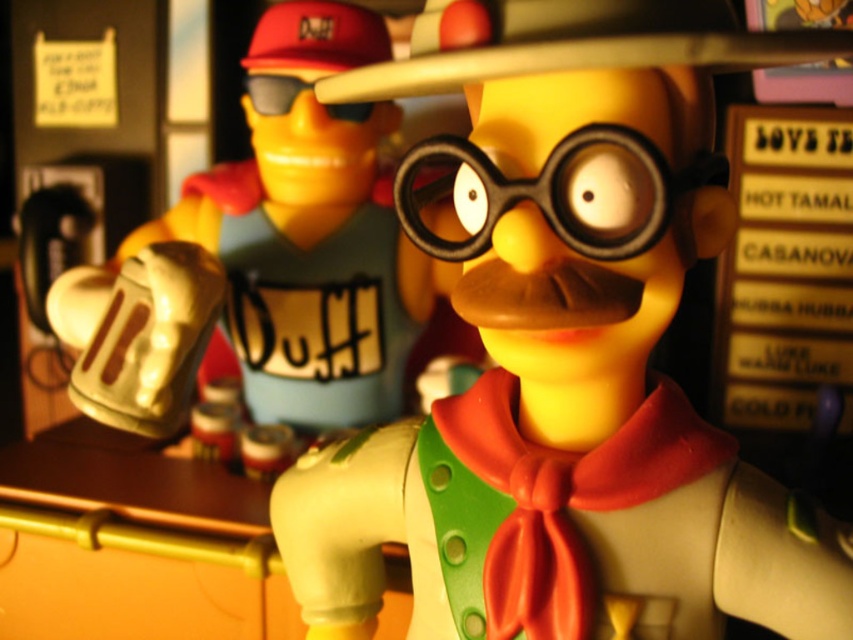
Between point (670, 65) and point (91, 368), which one is positioned behind?

Positioned behind is point (91, 368).

From the picture: Is matte plastic beer mug at upper left below metallic gold mug at upper left?

Correct, matte plastic beer mug at upper left is located below metallic gold mug at upper left.

Where is `matte plastic beer mug at upper left`? Image resolution: width=853 pixels, height=640 pixels. matte plastic beer mug at upper left is located at coordinates (563, 360).

How much distance is there between metallic gold mug at upper left and black matte goggles at upper center?

They are 6.11 inches apart.

Is metallic gold mug at upper left to the right of black matte goggles at upper center from the viewer's perspective?

In fact, metallic gold mug at upper left is to the left of black matte goggles at upper center.

Between point (189, 234) and point (288, 102), which one is positioned in front?

Point (288, 102) is more forward.

You are a GUI agent. You are given a task and a screenshot of the screen. Output one action in this format:
    pyautogui.click(x=<x>, y=<y>)
    Task: Click on the metallic gold mug at upper left
    
    Given the screenshot: What is the action you would take?
    [265, 282]

Looking at this image, does black rubber goggles at center have a greater height compared to black matte goggles at upper center?

Yes, black rubber goggles at center is taller than black matte goggles at upper center.

Who is higher up, black rubber goggles at center or black matte goggles at upper center?

black matte goggles at upper center is higher up.

This screenshot has width=853, height=640. In order to click on black rubber goggles at center in this screenshot , I will do `click(555, 193)`.